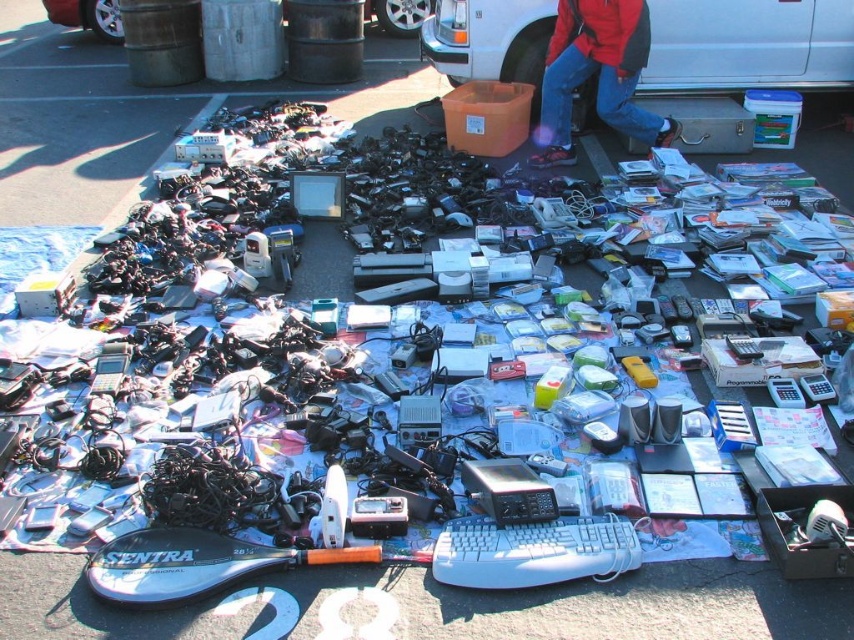
Does white matte van at upper right have a lesser height compared to red fabric jacket at upper center?

Yes, white matte van at upper right is shorter than red fabric jacket at upper center.

Does point (670, 67) lie behind point (595, 88)?

No, it is not.

Where is `white matte van at upper right`? The height and width of the screenshot is (640, 854). white matte van at upper right is located at coordinates (747, 45).

Who is more distant from viewer, (592, 19) or (395, 35)?

The point (395, 35) is more distant.

From the picture: Is red fabric jacket at upper center wider than silver metallic van at upper center?

Indeed, red fabric jacket at upper center has a greater width compared to silver metallic van at upper center.

Does point (572, 44) come behind point (427, 8)?

That is False.

This screenshot has width=854, height=640. In order to click on red fabric jacket at upper center in this screenshot , I will do `click(595, 74)`.

Between white matte van at upper right and silver metallic van at upper center, which one has more height?

white matte van at upper right

Where is `white matte van at upper right`? The image size is (854, 640). white matte van at upper right is located at coordinates (747, 45).